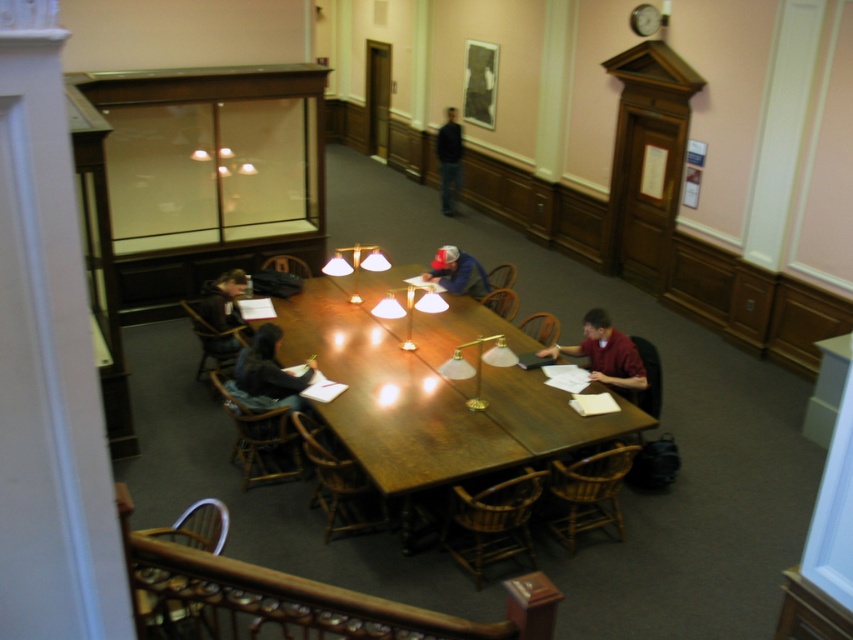
You are standing in the room and see the dark brown leather jacket at left and the dark blue jeans at center. Which item is positioned lower in the scene?

The dark brown leather jacket at left is located below the dark blue jeans at center, so it is positioned lower in the scene.

You are a person who wants to place a dark brown leather jacket at left on a chair next to a dark blue jeans at center. The chair has a width of 40 cm. Can the jacket fit on the chair without overlapping the jeans?

The dark brown leather jacket at left might be wider than dark blue jeans at center. Since the chair is 40 cm wide, there is a possibility that the jacket may not fit properly and could overlap the jeans if it exceeds the chair width.